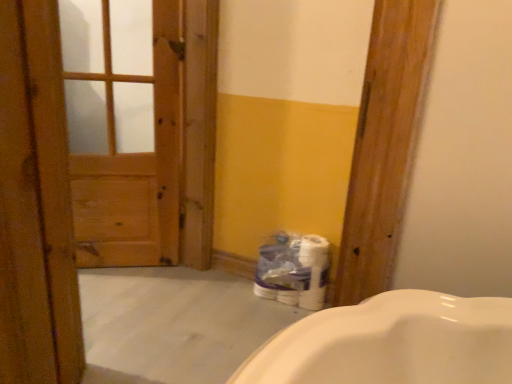
Question: Is wooden door at left surrounding white glossy toilet paper at lower center?

Choices:
 (A) yes
 (B) no

Answer: (B)

Question: Considering the relative sizes of wooden door at left and white glossy toilet paper at lower center in the image provided, is wooden door at left bigger than white glossy toilet paper at lower center?

Choices:
 (A) no
 (B) yes

Answer: (B)

Question: Is wooden door at left positioned in front of white glossy toilet paper at lower center?

Choices:
 (A) no
 (B) yes

Answer: (B)

Question: Does wooden door at left turn towards white glossy toilet paper at lower center?

Choices:
 (A) yes
 (B) no

Answer: (A)

Question: Would you consider wooden door at left to be distant from white glossy toilet paper at lower center?

Choices:
 (A) yes
 (B) no

Answer: (B)

Question: Is the depth of wooden door at left greater than that of white glossy toilet paper at lower center?

Choices:
 (A) no
 (B) yes

Answer: (A)

Question: Does white glossy toilet paper at lower center have a lesser height compared to wooden door at left?

Choices:
 (A) no
 (B) yes

Answer: (B)

Question: Are white glossy toilet paper at lower center and wooden door at left beside each other?

Choices:
 (A) yes
 (B) no

Answer: (B)

Question: Does white glossy toilet paper at lower center come in front of wooden door at left?

Choices:
 (A) no
 (B) yes

Answer: (A)

Question: Is white glossy toilet paper at lower center oriented away from wooden door at left?

Choices:
 (A) no
 (B) yes

Answer: (A)

Question: Does white glossy toilet paper at lower center have a smaller size compared to wooden door at left?

Choices:
 (A) no
 (B) yes

Answer: (B)

Question: Could wooden door at left be considered to be inside white glossy toilet paper at lower center?

Choices:
 (A) no
 (B) yes

Answer: (A)

Question: Considering the relative sizes of wooden door at left and wooden door at left in the image provided, is wooden door at left smaller than wooden door at left?

Choices:
 (A) yes
 (B) no

Answer: (B)